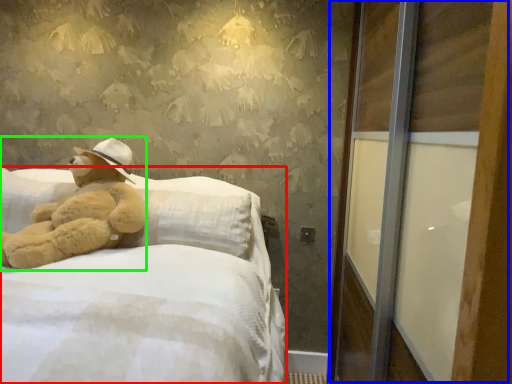
Question: Estimate the real-world distances between objects in this image. Which object is closer to bed (highlighted by a red box), screen door (highlighted by a blue box) or teddy bear (highlighted by a green box)?

Choices:
 (A) screen door
 (B) teddy bear

Answer: (B)